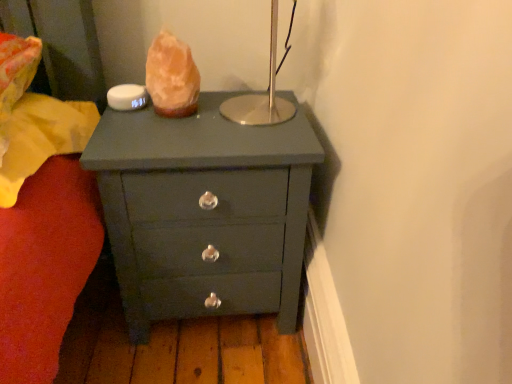
The height and width of the screenshot is (384, 512). What are the coordinates of `empty space that is to the right of orange crystal at center` in the screenshot? It's located at (239, 113).